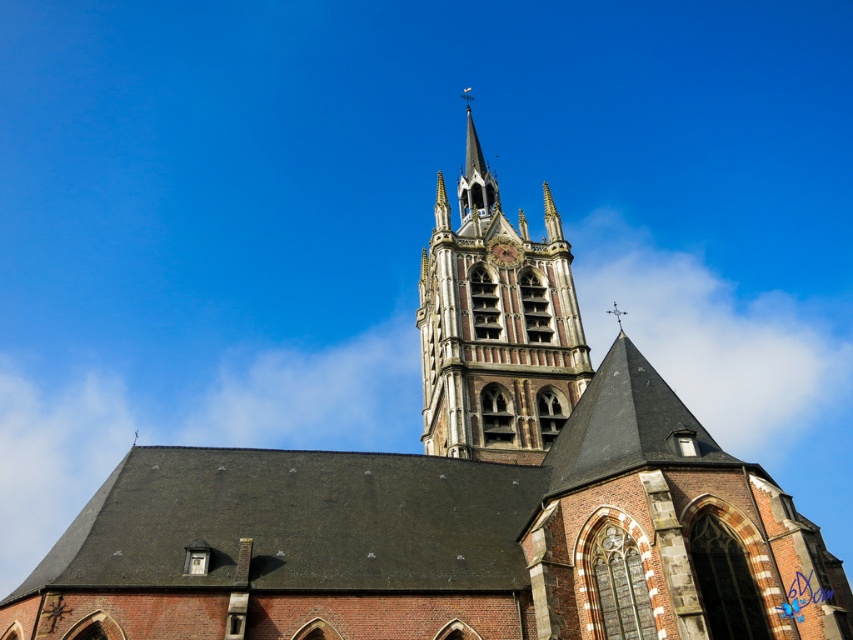
Based on the photo, who is more distant from viewer, (468, 97) or (495, 244)?

Positioned behind is point (468, 97).

Does brown stone tower at center appear under brass textured clock at upper center?

No.

Looking at this image, who is more forward, (421, 339) or (506, 250)?

Point (506, 250) is in front.

At what (x,y) coordinates should I click in order to perform the action: click on brown stone tower at center. Please return your answer as a coordinate pair (x, y). This screenshot has height=640, width=853. Looking at the image, I should click on (495, 326).

From the picture: Which of these two, brown stone tower at center or polished silver spire at upper center, stands shorter?

polished silver spire at upper center is shorter.

Which is below, brown stone tower at center or polished silver spire at upper center?

brown stone tower at center

Between point (508, 433) and point (480, 161), which one is positioned behind?

Point (480, 161)

This screenshot has height=640, width=853. Find the location of `brown stone tower at center`. brown stone tower at center is located at coordinates (495, 326).

Which is above, polished silver spire at upper center or brass textured clock at upper center?

polished silver spire at upper center

Is polished silver spire at upper center further to the viewer compared to brass textured clock at upper center?

Yes, it is behind brass textured clock at upper center.

Which is behind, point (494, 182) or point (514, 260)?

The point (494, 182) is more distant.

The image size is (853, 640). I want to click on polished silver spire at upper center, so click(x=474, y=173).